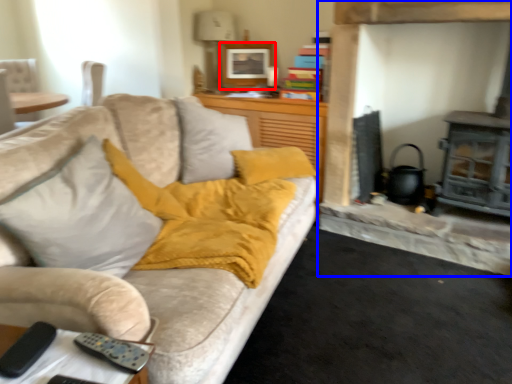
Question: Among these objects, which one is farthest to the camera, picture frame (highlighted by a red box) or fireplace (highlighted by a blue box)?

Choices:
 (A) picture frame
 (B) fireplace

Answer: (A)